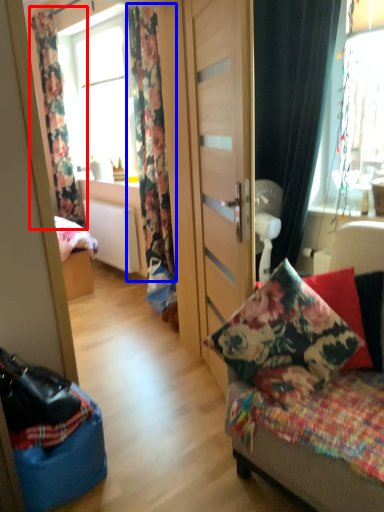
Question: Which object is further to the camera taking this photo, curtain (highlighted by a red box) or curtain (highlighted by a blue box)?

Choices:
 (A) curtain
 (B) curtain

Answer: (A)